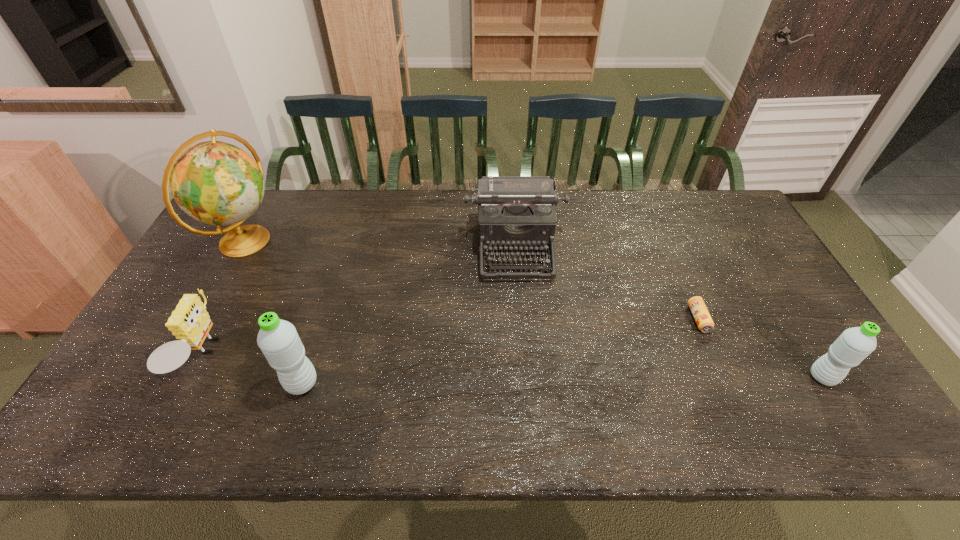
You are a GUI agent. You are given a task and a screenshot of the screen. Output one action in this format:
    pyautogui.click(x=<x>, y=<y>)
    Task: Click on the object that can be found as the fifth closest to the globe
    This screenshot has height=540, width=960.
    Given the screenshot: What is the action you would take?
    pyautogui.click(x=854, y=344)

Where is `free location that satisfies the following two spatial constraints: 1. on the front-facing side of the sponge; 2. on the back side of the rightmost object`? Image resolution: width=960 pixels, height=540 pixels. free location that satisfies the following two spatial constraints: 1. on the front-facing side of the sponge; 2. on the back side of the rightmost object is located at coordinates (192, 377).

What are the coordinates of `free location that satisfies the following two spatial constraints: 1. on the front-facing side of the fifth tallest object; 2. on the left side of the taller water bottle` in the screenshot? It's located at (188, 383).

Where is `free location that satisfies the following two spatial constraints: 1. on the typing side of the third object from right to left; 2. on the front-facing side of the fifth tallest object`? This screenshot has height=540, width=960. free location that satisfies the following two spatial constraints: 1. on the typing side of the third object from right to left; 2. on the front-facing side of the fifth tallest object is located at coordinates (523, 356).

Locate an element on the screen. This screenshot has height=540, width=960. blank space that satisfies the following two spatial constraints: 1. on the front-facing side of the rightmost object; 2. on the left side of the fifth tallest object is located at coordinates (192, 377).

I want to click on vacant position in the image that satisfies the following two spatial constraints: 1. on the front-facing side of the second shortest object; 2. on the back side of the fifth shortest object, so click(188, 383).

Locate an element on the screen. vacant area in the image that satisfies the following two spatial constraints: 1. on the typing side of the typewriter; 2. on the front-facing side of the second shortest object is located at coordinates (523, 356).